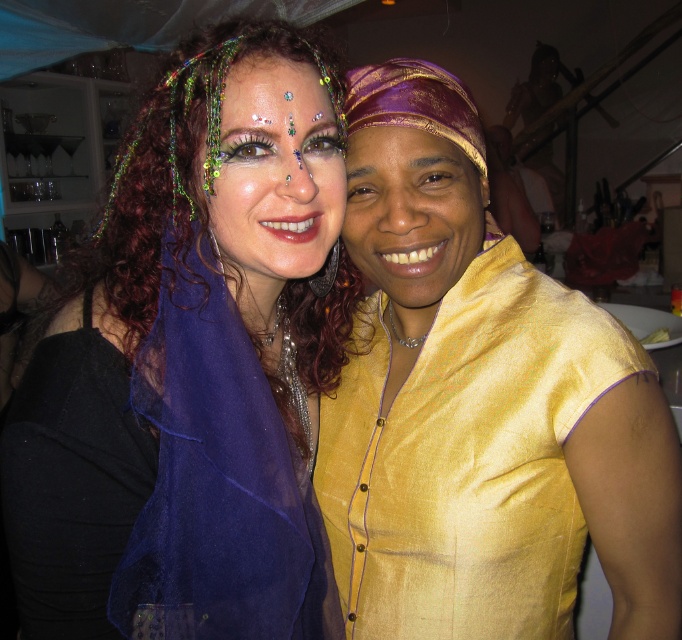
Does gold silk blouse at center come in front of shiny green headband at center?

No, it is behind shiny green headband at center.

Between point (546, 595) and point (327, 186), which one is positioned in front?

Point (327, 186) is in front.

The width and height of the screenshot is (682, 640). I want to click on gold silk blouse at center, so click(477, 403).

Between gold silk blouse at center and gold silk scarf at right, which one appears on the right side from the viewer's perspective?

gold silk blouse at center

Between gold silk blouse at center and gold silk scarf at right, which one has less height?

With less height is gold silk scarf at right.

Describe the element at coordinates (477, 403) in the screenshot. The height and width of the screenshot is (640, 682). I see `gold silk blouse at center` at that location.

Locate an element on the screen. gold silk blouse at center is located at coordinates (477, 403).

Between point (299, 152) and point (409, 145), which one is positioned in front?

Point (299, 152) is more forward.

Between point (72, 476) and point (372, 154), which one is positioned behind?

The point (372, 154) is behind.

The image size is (682, 640). In order to click on matte black dress at center in this screenshot , I will do `click(192, 362)`.